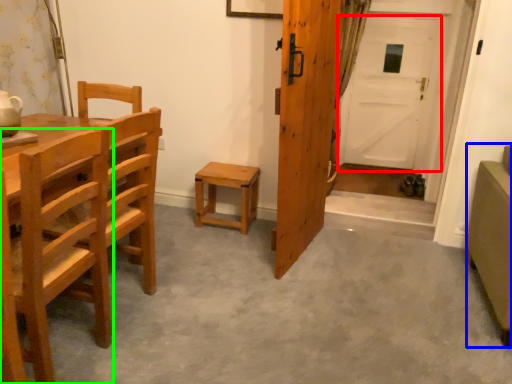
Question: Which is farther away from door (highlighted by a red box)? armchair (highlighted by a blue box) or chair (highlighted by a green box)?

Choices:
 (A) armchair
 (B) chair

Answer: (B)